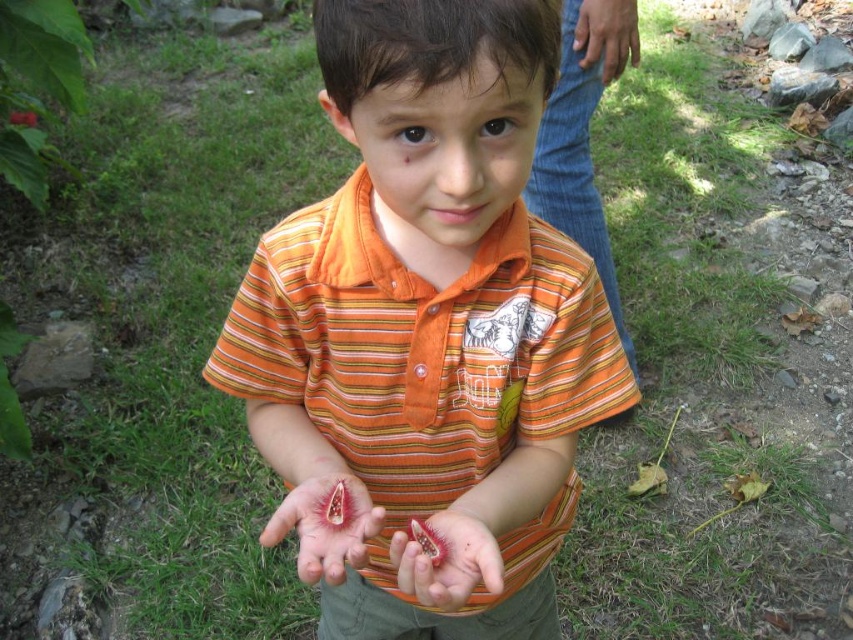
You are a photographer trying to capture the child in the center without any hands blocking the view. Based on the sizes of the orange striped shirt at center and the brown leather hand at upper right, which object would you need to avoid overlapping with the child?

The orange striped shirt at center is larger in size than the brown leather hand at upper right, so you should avoid the orange striped shirt at center as it is bigger and more likely to block the child.

You are a photographer trying to capture the pink flesh at center and the brown leather hand at upper right in the same frame. Based on their positions, which object is closer to the bottom edge of the photo?

The pink flesh at center is closer to the bottom edge of the photo because it is located below the brown leather hand at upper right.

You are a photographer trying to capture the child holding the pink flesh at center and the brown leather hand at upper right. Based on their sizes, which object should you focus on first to ensure it fits entirely within the frame?

The pink flesh at center is shorter than the brown leather hand at upper right, so you should focus on capturing the brown leather hand at upper right first since it is larger and requires more space to fit entirely within the frame.